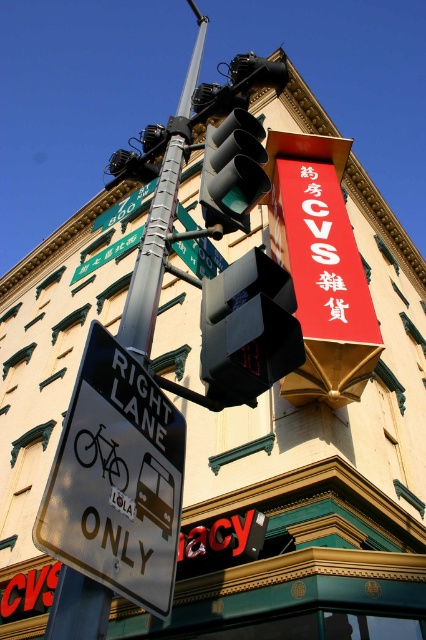
How much distance is there between metallic pole at left and white plastic sign at upper left?

metallic pole at left is 9.20 meters away from white plastic sign at upper left.

Who is higher up, metallic pole at left or white plastic sign at upper left?

Positioned higher is metallic pole at left.

From the picture: Who is more distant from viewer, (127, 337) or (115, 385)?

Point (127, 337)

You are a GUI agent. You are given a task and a screenshot of the screen. Output one action in this format:
    pyautogui.click(x=<x>, y=<y>)
    Task: Click on the metallic pole at left
    This screenshot has width=426, height=640.
    Given the screenshot: What is the action you would take?
    pyautogui.click(x=160, y=221)

Between point (131, 385) and point (101, 236), which one is positioned in front?

Point (131, 385) is in front.

The image size is (426, 640). Describe the element at coordinates (143, 401) in the screenshot. I see `white plastic sign at upper left` at that location.

Where is `white plastic sign at upper left`? white plastic sign at upper left is located at coordinates (143, 401).

Between green matte traffic light at upper center and white plastic sign at upper left, which one has less height?

green matte traffic light at upper center is shorter.

Between point (215, 148) and point (127, 410), which one is positioned in front?

Point (127, 410) is more forward.

At what (x,y) coordinates should I click in order to perform the action: click on green matte traffic light at upper center. Please return your answer as a coordinate pair (x, y). Looking at the image, I should click on (233, 172).

Identify the location of green matte traffic light at upper center. The width and height of the screenshot is (426, 640). (233, 172).